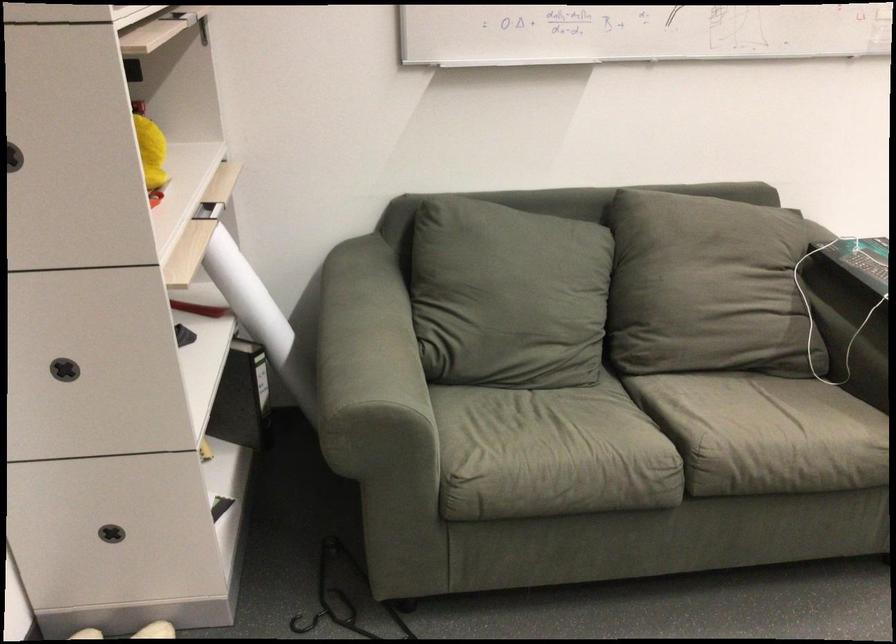
Where would you lift the black metal hook? Please return your answer as a coordinate pair (x, y).

(341, 598)